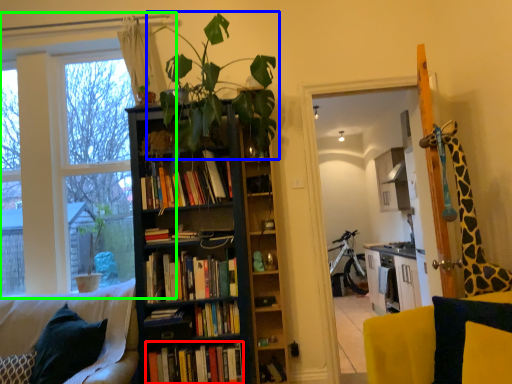
Question: Which is nearer to the book (highlighted by a red box)? houseplant (highlighted by a blue box) or window frame (highlighted by a green box).

Choices:
 (A) houseplant
 (B) window frame

Answer: (B)